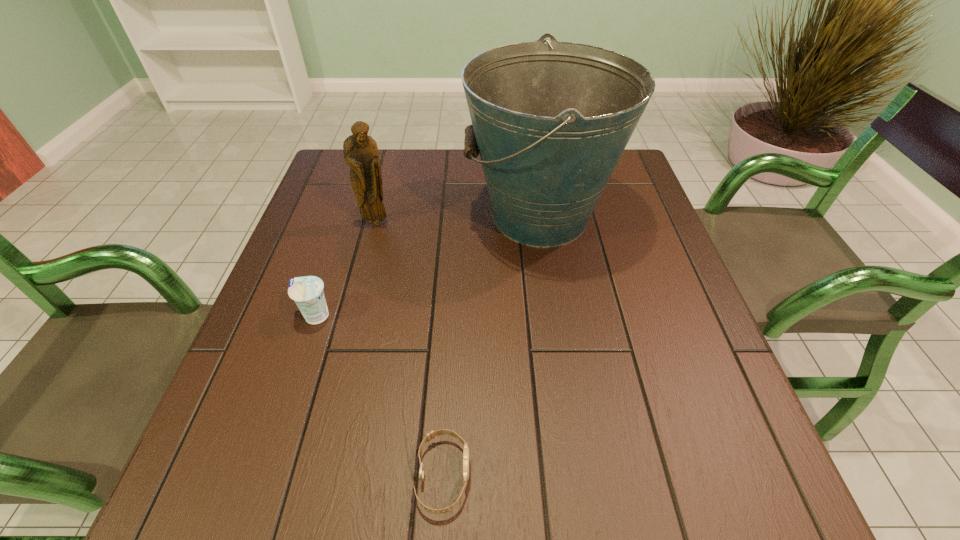
The width and height of the screenshot is (960, 540). I want to click on empty space that is in between the tallest object and the second tallest object, so click(x=458, y=219).

The width and height of the screenshot is (960, 540). I want to click on free space between the second shortest object and the shortest object, so click(379, 396).

Where is `free point between the watch and the tallest object`? The width and height of the screenshot is (960, 540). free point between the watch and the tallest object is located at coordinates (492, 346).

The image size is (960, 540). I want to click on object that ranks as the closest to the watch, so click(x=307, y=292).

Identify which object is the closest to the second tallest object. Please provide its 2D coordinates. Your answer should be formatted as a tuple, i.e. [(x, y)], where the tuple contains the x and y coordinates of a point satisfying the conditions above.

[(550, 121)]

Where is `free location that satisfies the following two spatial constraints: 1. with the handle on opposite sides of the bucket; 2. on the front-facing side of the third shortest object`? free location that satisfies the following two spatial constraints: 1. with the handle on opposite sides of the bucket; 2. on the front-facing side of the third shortest object is located at coordinates (540, 222).

Locate an element on the screen. Image resolution: width=960 pixels, height=540 pixels. free location that satisfies the following two spatial constraints: 1. with the handle on opposite sides of the tallest object; 2. on the front side of the yogurt is located at coordinates (555, 316).